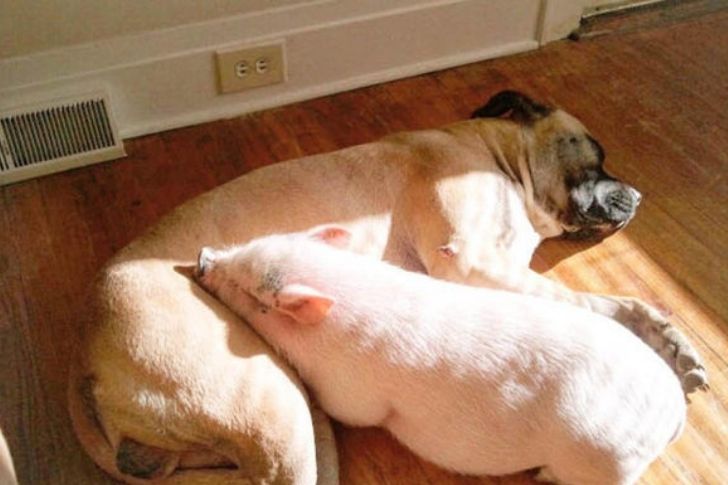
I want to click on threshold, so click(x=643, y=13).